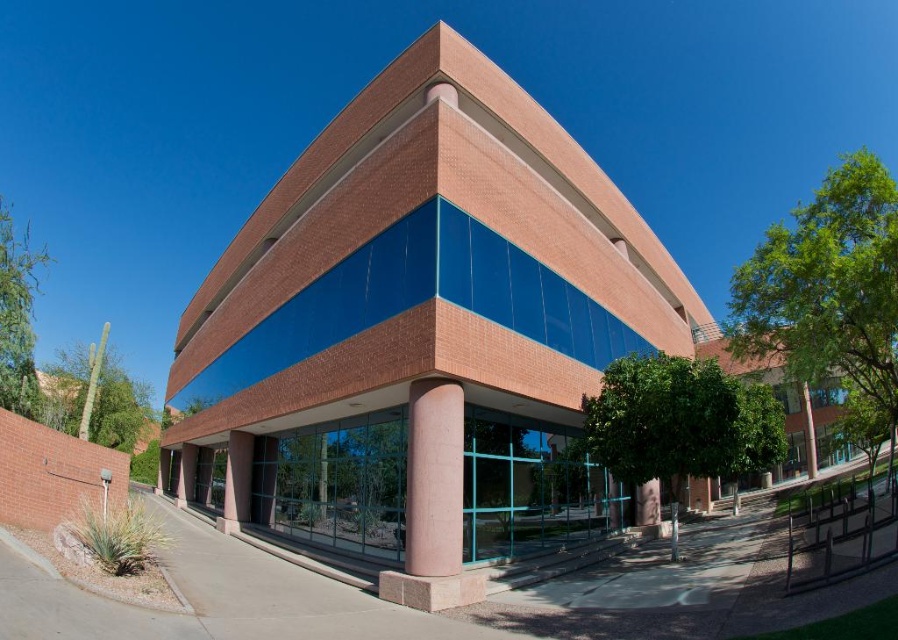
You are an architect planning to install a decorative fence between the pink concrete column at center and the smooth concrete pillar at lower center. The fence requires a minimum distance of 15 meters between the two points to be installed. Can the fence be installed between these two objects based on their current spacing?

The pink concrete column at center and smooth concrete pillar at lower center are 17.16 meters apart from each other, which exceeds the required 15 meters. Therefore, the fence can be installed between them.

You are a city planner assessing the space between the pink concrete column at center and the smooth concrete pillar at lower center. Based on their sizes, which one would require more area to place a bench nearby?

The smooth concrete pillar at lower center requires more area because it occupies more space than the pink concrete column at center.